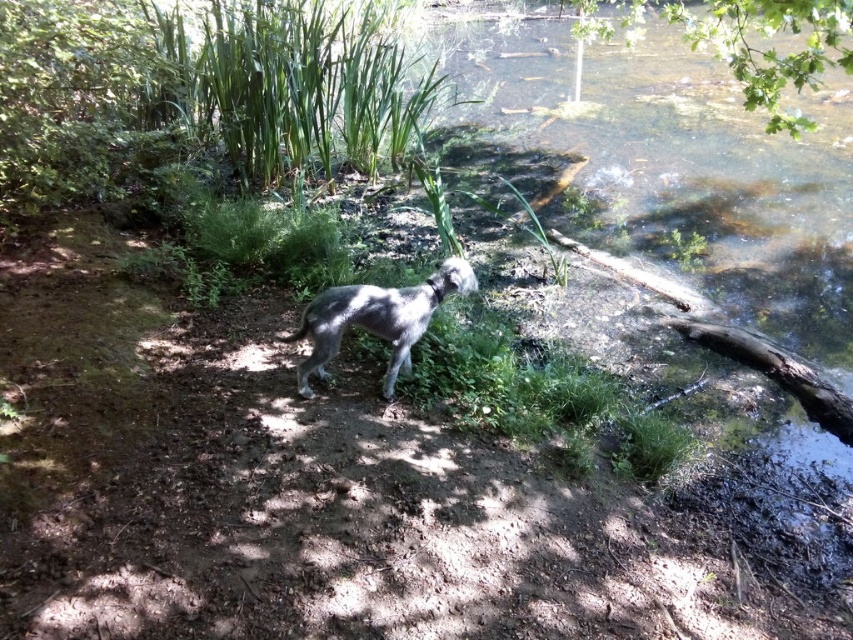
Question: Does green leafy tree at upper right lie behind fuzzy gray dog at center?

Choices:
 (A) yes
 (B) no

Answer: (B)

Question: Does green leafy tree at upper right have a lesser width compared to fuzzy gray dog at center?

Choices:
 (A) yes
 (B) no

Answer: (B)

Question: Among these objects, which one is farthest from the camera?

Choices:
 (A) green leafy tree at upper right
 (B) fuzzy gray dog at center

Answer: (B)

Question: Does green leafy tree at upper right have a lesser width compared to fuzzy gray dog at center?

Choices:
 (A) yes
 (B) no

Answer: (B)

Question: Which of the following is the farthest from the observer?

Choices:
 (A) fuzzy gray dog at center
 (B) green leafy tree at upper right

Answer: (A)